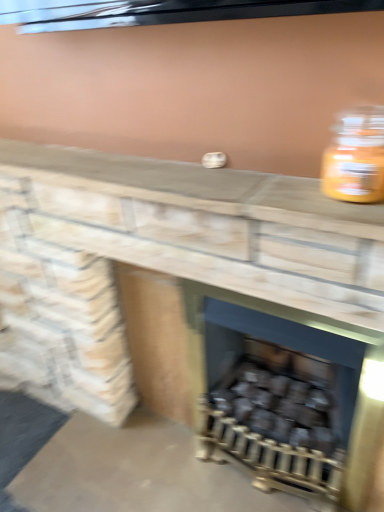
Question: Based on their positions, is smooth stone counter at center located to the left or right of translucent glass jar at upper right?

Choices:
 (A) right
 (B) left

Answer: (B)

Question: From the image's perspective, is smooth stone counter at center above or below translucent glass jar at upper right?

Choices:
 (A) below
 (B) above

Answer: (B)

Question: Which object is positioned farthest from the translucent glass jar at upper right?

Choices:
 (A) dark gray matte wood burning stove at center
 (B) smooth stone counter at center
 (C) black matte wood at center
 (D) smooth stone fireplace at center

Answer: (C)

Question: Estimate the real-world distances between objects in this image. Which object is closer to the translucent glass jar at upper right?

Choices:
 (A) smooth stone counter at center
 (B) black matte wood at center
 (C) smooth stone fireplace at center
 (D) dark gray matte wood burning stove at center

Answer: (A)